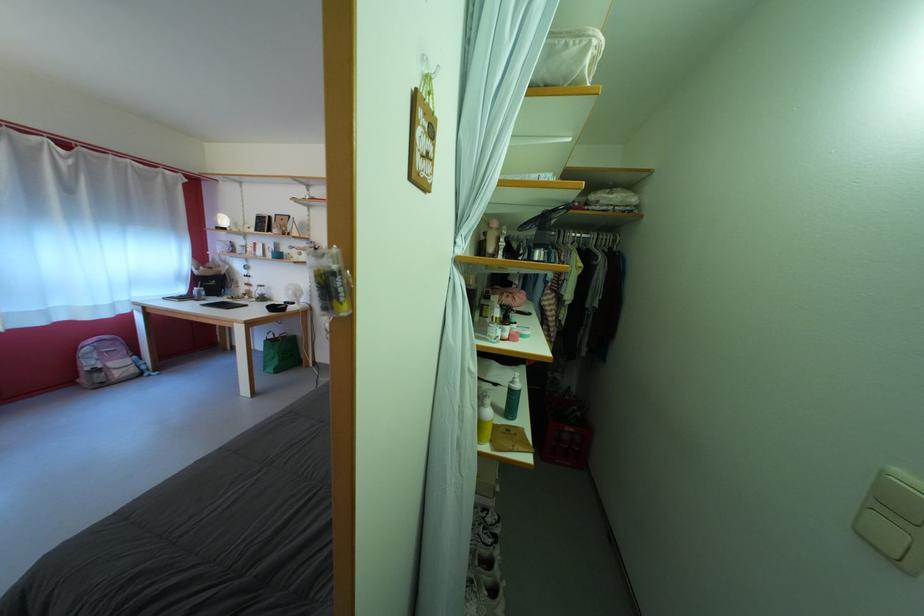
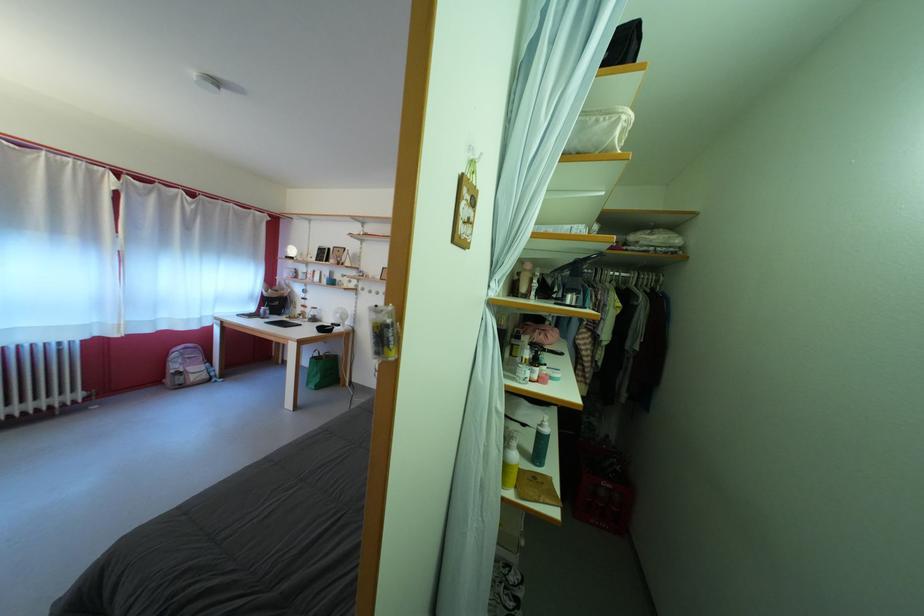
Where in the second image is the point corresponding to pixel 327 290 from the first image?

(383, 339)